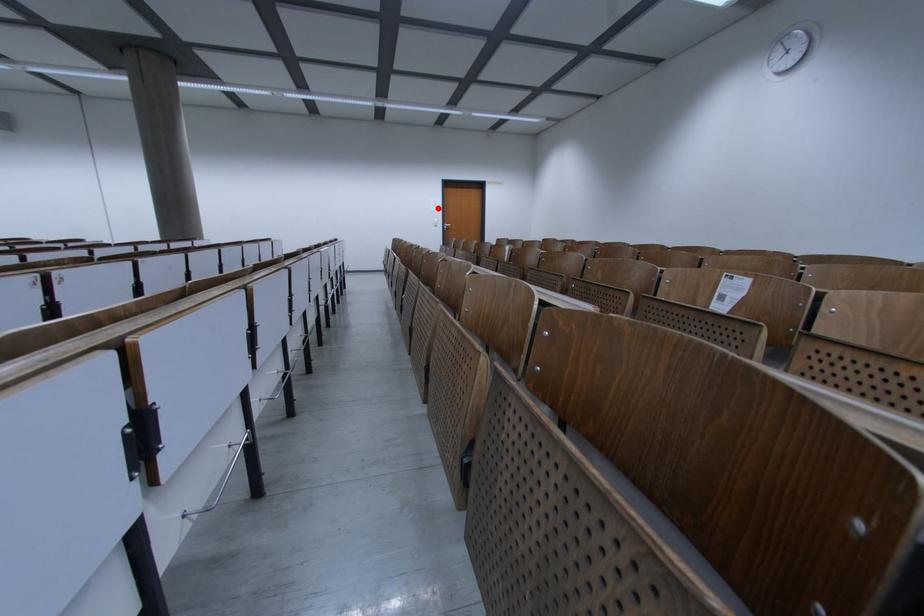
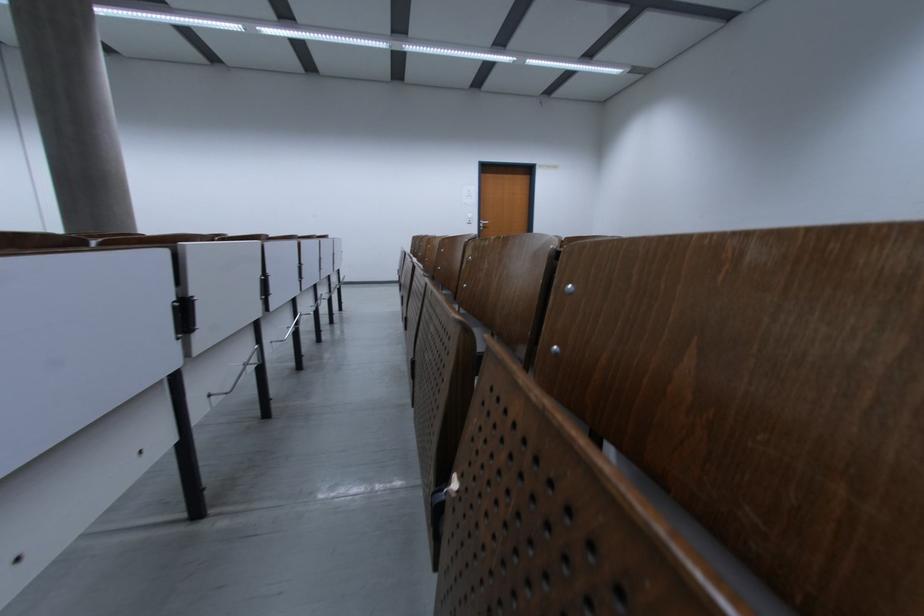
Question: I am providing you with two images of the same scene from different viewpoints. A red point is marked on the first image. Is the red point's position out of view in image 2?

Choices:
 (A) Yes
 (B) No

Answer: (B)